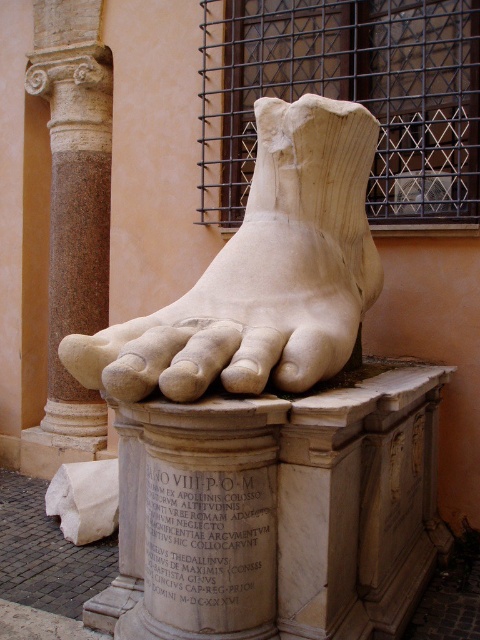
Question: Does white marble foot at center have a lesser width compared to granite column at left?

Choices:
 (A) yes
 (B) no

Answer: (B)

Question: Does white marble foot at center appear over granite column at left?

Choices:
 (A) no
 (B) yes

Answer: (A)

Question: Which of the following is the farthest from the observer?

Choices:
 (A) (83, 307)
 (B) (168, 324)

Answer: (A)

Question: Which point is closer to the camera?

Choices:
 (A) white marble foot at center
 (B) granite column at left

Answer: (A)

Question: Can you confirm if white marble foot at center is positioned to the left of granite column at left?

Choices:
 (A) yes
 (B) no

Answer: (B)